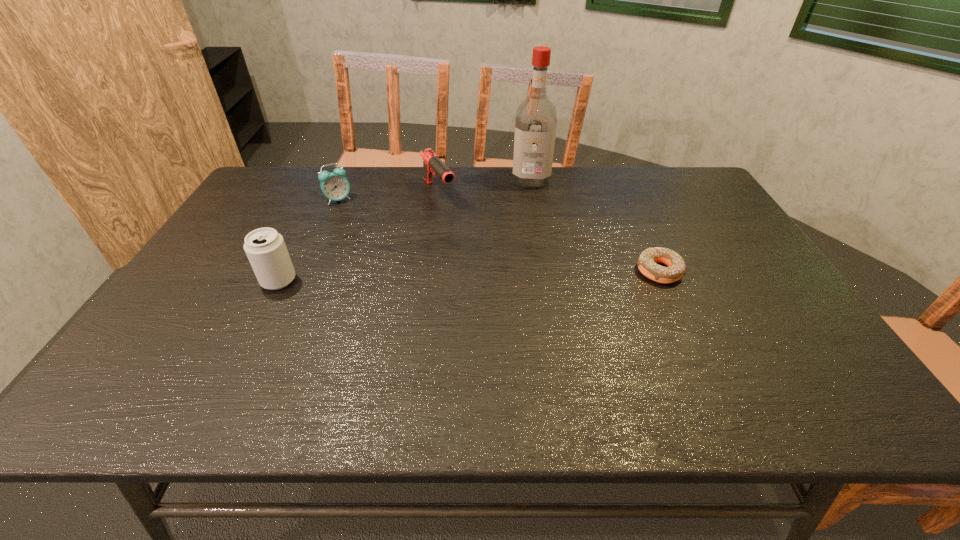
Identify the location of can. (265, 248).

Locate an element on the screen. This screenshot has width=960, height=540. doughnut is located at coordinates (647, 260).

Identify the location of the shortest object. The height and width of the screenshot is (540, 960). (647, 260).

Identify the location of gun. (431, 162).

Find the location of a particular element. the tallest object is located at coordinates (536, 118).

The height and width of the screenshot is (540, 960). I want to click on liquor, so click(x=536, y=118).

In order to click on alarm clock in this screenshot , I will do `click(334, 185)`.

Image resolution: width=960 pixels, height=540 pixels. What are the coordinates of `blank area located on the left of the can` in the screenshot? It's located at (200, 280).

This screenshot has height=540, width=960. Identify the location of blank space located on the left of the shortest object. (584, 271).

What are the coordinates of `vacant space located at the aiming end of the third object from right to left` in the screenshot? It's located at (456, 220).